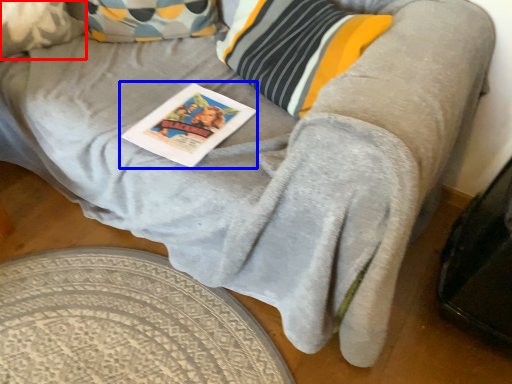
Question: Which object appears farthest to the camera in this image, pillow (highlighted by a red box) or magazine (highlighted by a blue box)?

Choices:
 (A) pillow
 (B) magazine

Answer: (A)